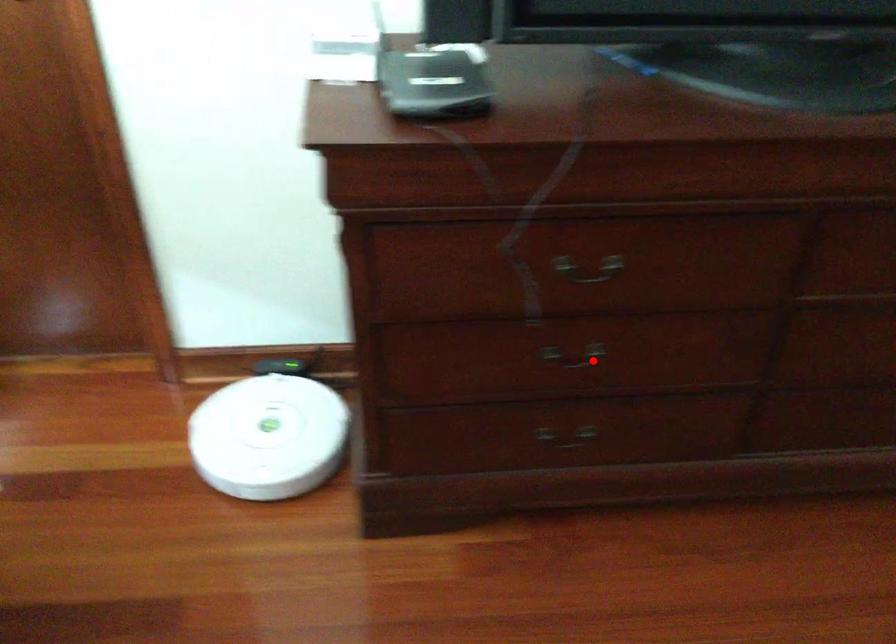
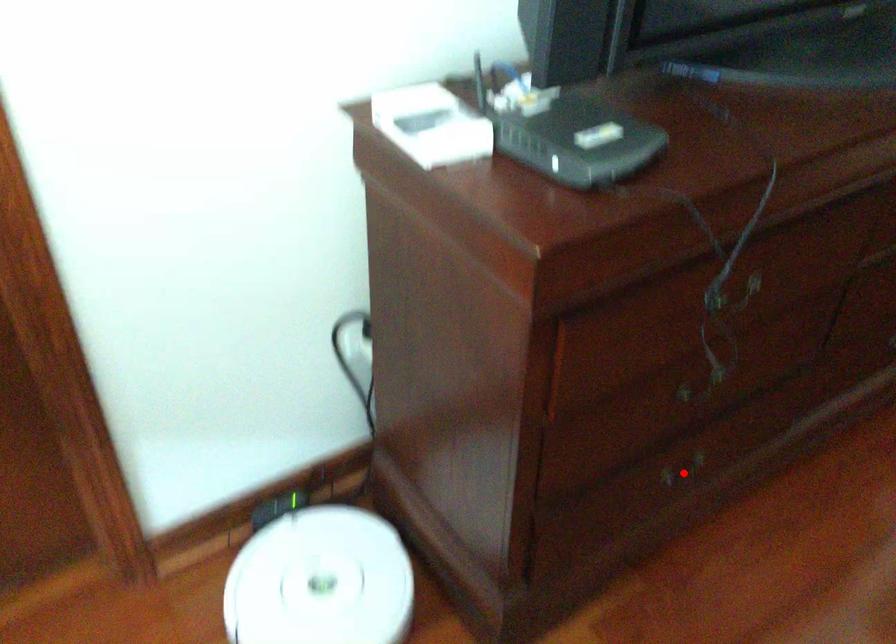
I am providing you with two images of the same scene from different viewpoints. A red point is marked on the first image and another point is marked on the second image. Is the marked point in image1 the same physical position as the marked point in image2?

No